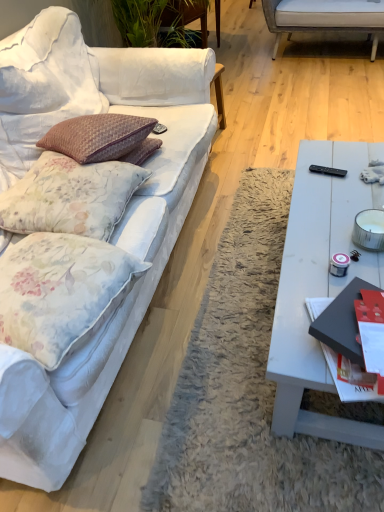
The height and width of the screenshot is (512, 384). Identify the location of vacant space underneath red glossy magazine at right (from a real-world perspective). (334, 364).